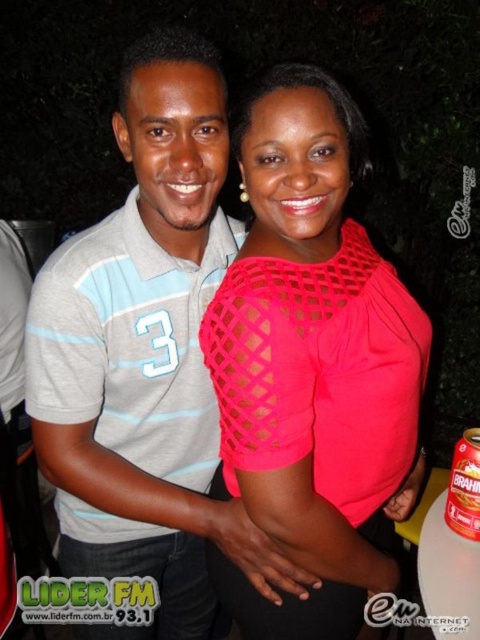
Question: Does bright pink mesh top at center appear over gray striped polo shirt at center?

Choices:
 (A) no
 (B) yes

Answer: (B)

Question: Based on their relative distances, which object is farther from the brown cardboard can at lower right?

Choices:
 (A) bright pink mesh top at center
 (B) gray striped polo shirt at center

Answer: (B)

Question: Can you confirm if bright pink mesh top at center is positioned below gray striped polo shirt at center?

Choices:
 (A) yes
 (B) no

Answer: (B)

Question: Which object is farther from the camera taking this photo?

Choices:
 (A) bright pink mesh top at center
 (B) brown cardboard can at lower right

Answer: (B)

Question: Can you confirm if bright pink mesh top at center is positioned above gray striped polo shirt at center?

Choices:
 (A) yes
 (B) no

Answer: (A)

Question: Considering the real-world distances, which object is closest to the brown cardboard can at lower right?

Choices:
 (A) gray striped polo shirt at center
 (B) bright pink mesh top at center

Answer: (B)